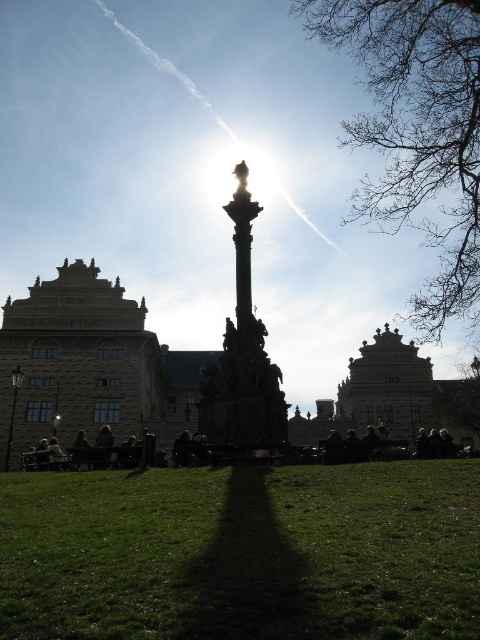
You are standing at the monument and want to take a photo that includes both point (32, 376) and point (107, 461). Which point will appear closer to the camera in the photo?

Point (32, 376) will appear closer to the camera in the photo because it is further to the viewer than point (107, 461).